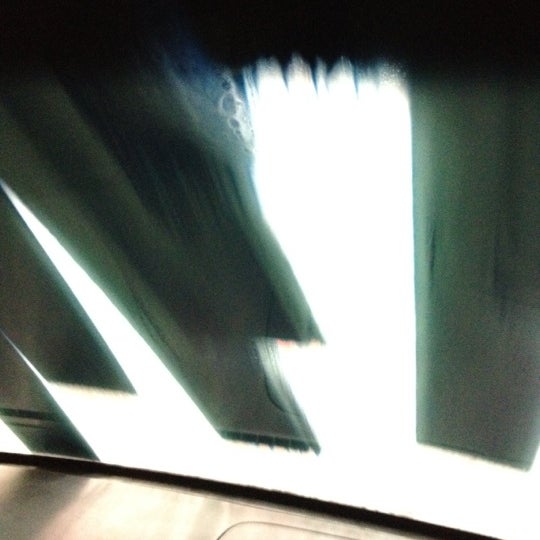
Locate an element on the screen. Image resolution: width=540 pixels, height=540 pixels. light reflection on the floor is located at coordinates (120, 514).